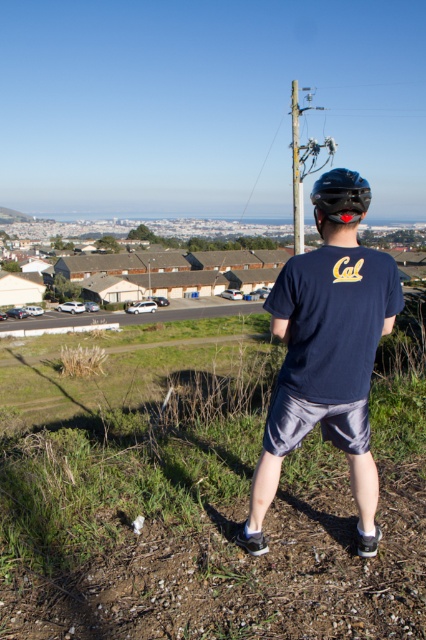
Question: Which of the following is the closest to the observer?

Choices:
 (A) black matte helmet at center
 (B) brown dirt track at lower center
 (C) navy blue t-shirt at center

Answer: (B)

Question: Which object is positioned closest to the navy blue t-shirt at center?

Choices:
 (A) brown dirt track at lower center
 (B) black matte helmet at center

Answer: (A)

Question: Does brown dirt track at lower center appear under navy blue t-shirt at center?

Choices:
 (A) yes
 (B) no

Answer: (A)

Question: Is brown dirt track at lower center below black matte helmet at center?

Choices:
 (A) yes
 (B) no

Answer: (A)

Question: Can you confirm if brown dirt track at lower center is wider than navy blue t-shirt at center?

Choices:
 (A) no
 (B) yes

Answer: (B)

Question: Among these objects, which one is nearest to the camera?

Choices:
 (A) navy blue t-shirt at center
 (B) black matte helmet at center
 (C) brown dirt track at lower center

Answer: (C)